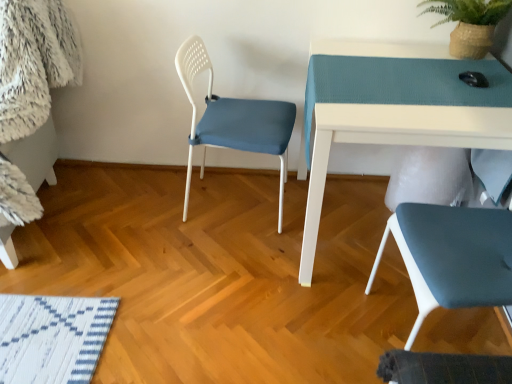
At what (x,y) coordinates should I click in order to perform the action: click on vacant area situated to the left side of white glossy table at upper right. Please return your answer as a coordinate pair (x, y). Looking at the image, I should click on (209, 267).